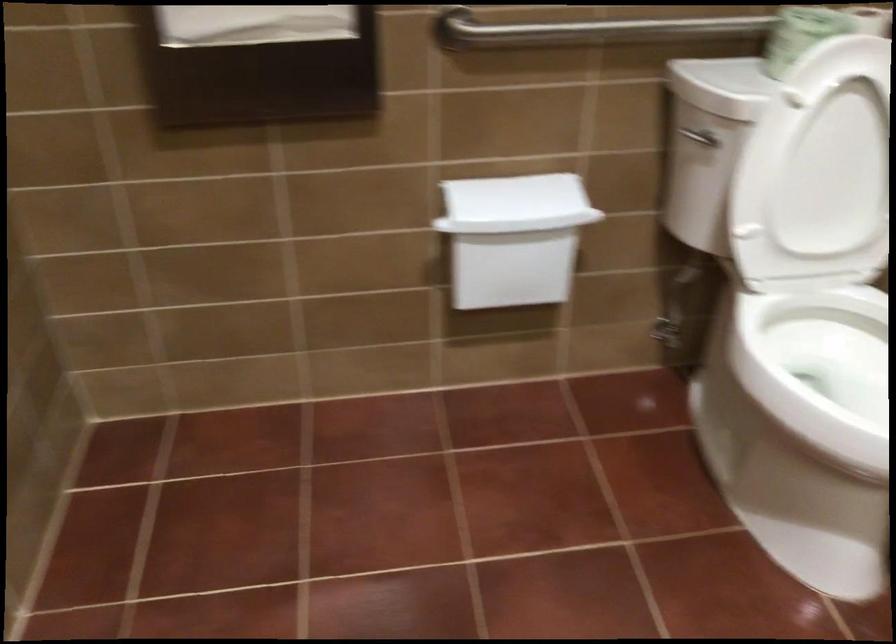
The image size is (896, 644). Describe the element at coordinates (819, 368) in the screenshot. I see `the white toilet seat` at that location.